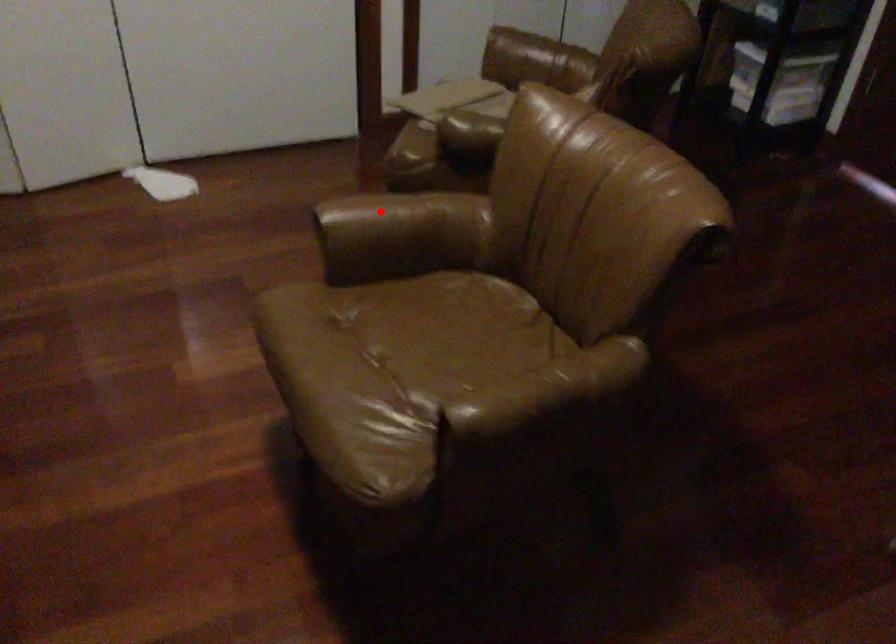
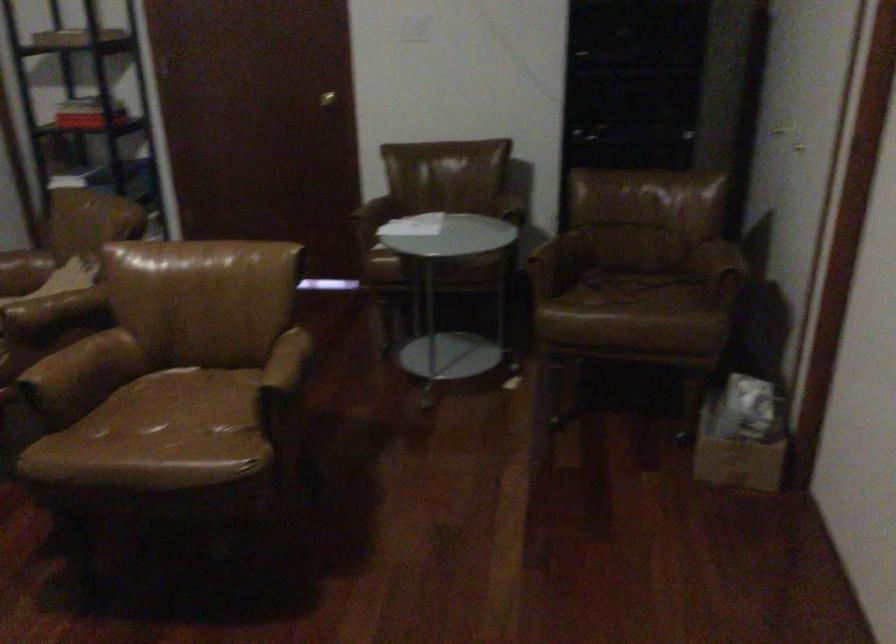
Question: I am providing you with two images of the same scene from different viewpoints. In image1, a red point is highlighted. Considering the same 3D point in image2, which of the following is correct?

Choices:
 (A) It is closer
 (B) It is farther

Answer: (B)